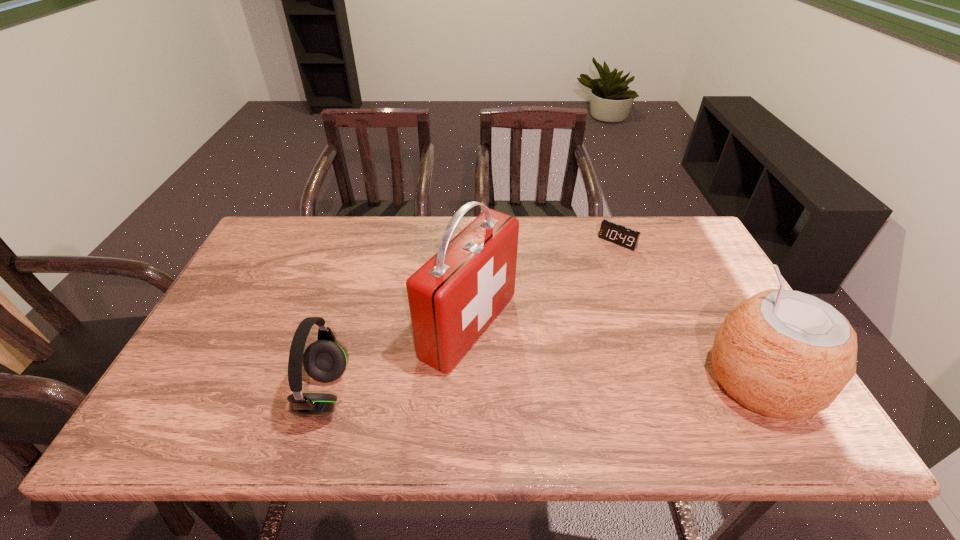
Image resolution: width=960 pixels, height=540 pixels. Find the location of `the third tallest object`. the third tallest object is located at coordinates (325, 360).

Find the location of a particular element. The image size is (960, 540). the leftmost object is located at coordinates (325, 360).

Find the location of `the second tallest object`. the second tallest object is located at coordinates (785, 354).

The image size is (960, 540). Find the location of `the rightmost object`. the rightmost object is located at coordinates (785, 354).

At what (x,y) coordinates should I click in order to perform the action: click on the tallest object. Please return your answer as a coordinate pair (x, y). The image size is (960, 540). Looking at the image, I should click on (453, 297).

Locate an element on the screen. the third object from right to left is located at coordinates (453, 297).

The width and height of the screenshot is (960, 540). What are the coordinates of `alarm clock` in the screenshot? It's located at (628, 238).

This screenshot has width=960, height=540. Identify the location of the shortest object. (628, 238).

Identify the location of vacant region located 0.240m on the ear cups of the headset. [197, 393].

This screenshot has height=540, width=960. In order to click on free region located 0.120m on the ear cups of the headset in this screenshot , I will do `click(250, 393)`.